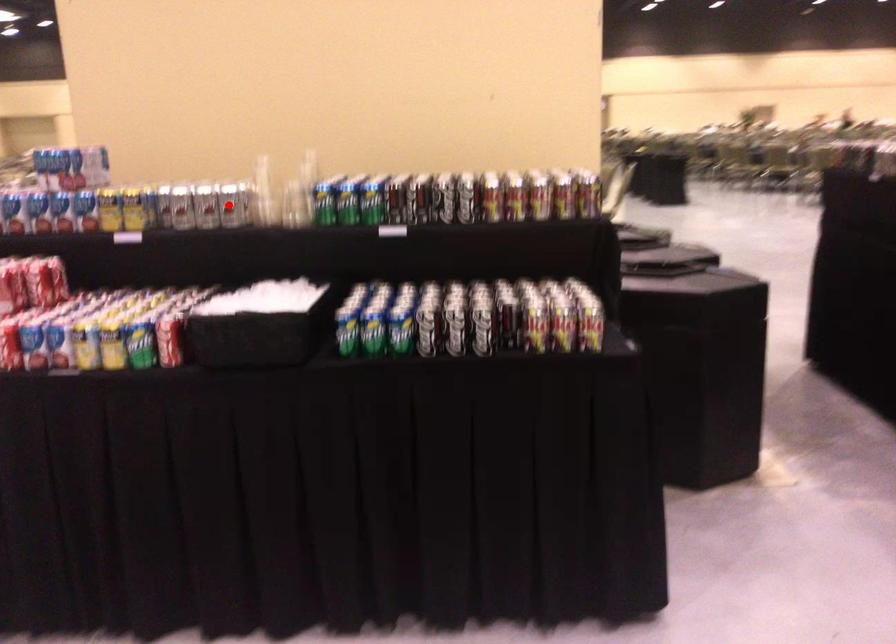
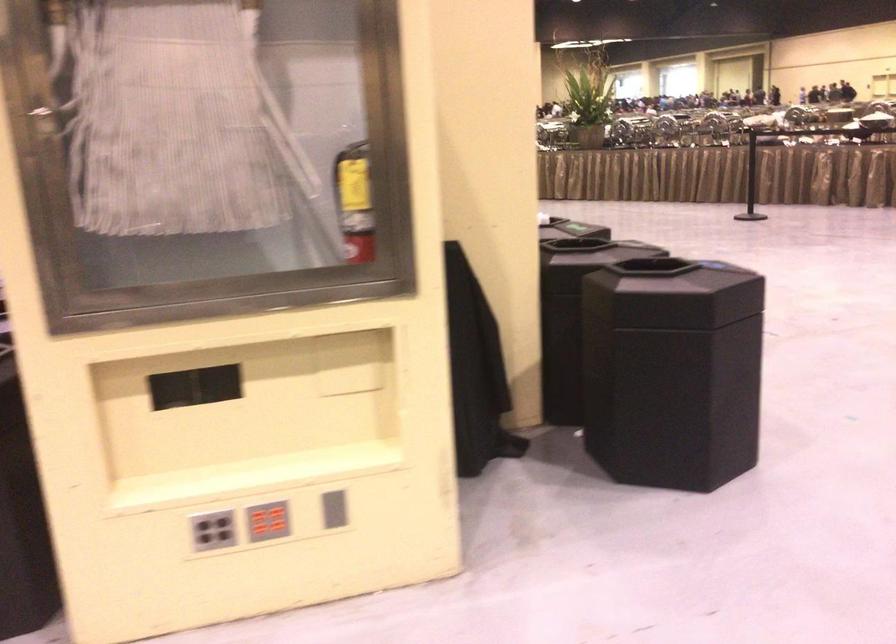
Question: I am providing you with two images of the same scene from different viewpoints. A red point is marked on the first image. Is the red point's position out of view in image 2?

Choices:
 (A) Yes
 (B) No

Answer: (A)